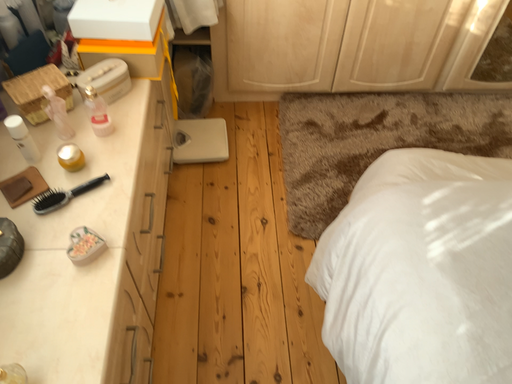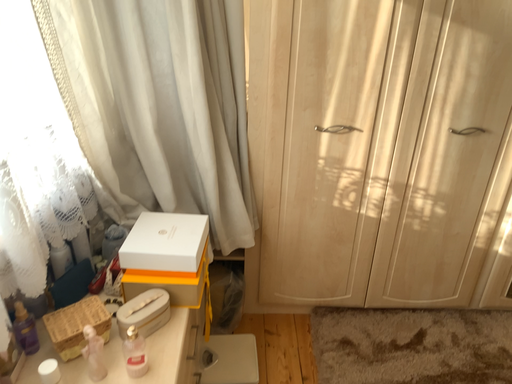
Question: Which way did the camera rotate in the video?

Choices:
 (A) rotated downward
 (B) rotated upward

Answer: (B)